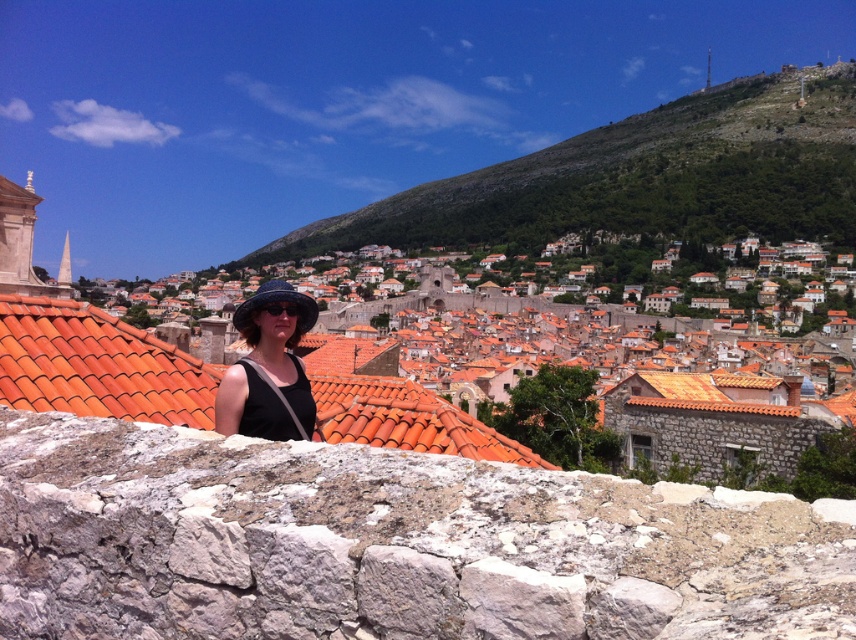
Question: Which of these objects is positioned closest to the matte black hat at center?

Choices:
 (A) blue fabric hat at center
 (B) orange clay tiles at center
 (C) green grassy hillside at upper center

Answer: (B)

Question: Estimate the real-world distances between objects in this image. Which object is farther from the orange clay tiles at center?

Choices:
 (A) matte black hat at center
 (B) blue fabric hat at center
 (C) green grassy hillside at upper center

Answer: (C)

Question: Among these points, which one is nearest to the camera?

Choices:
 (A) click(354, 240)
 (B) click(413, 426)

Answer: (B)

Question: Does green grassy hillside at upper center appear under matte black hat at center?

Choices:
 (A) yes
 (B) no

Answer: (B)

Question: Does green grassy hillside at upper center appear on the left side of orange clay tiles at center?

Choices:
 (A) no
 (B) yes

Answer: (A)

Question: Does green grassy hillside at upper center appear on the left side of blue fabric hat at center?

Choices:
 (A) yes
 (B) no

Answer: (B)